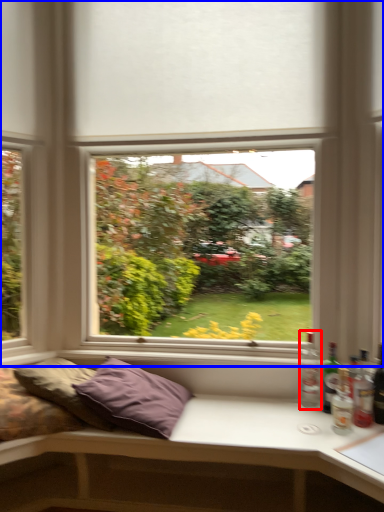
Question: Which object is closer to the camera taking this photo, bottle (highlighted by a red box) or window (highlighted by a blue box)?

Choices:
 (A) bottle
 (B) window

Answer: (B)